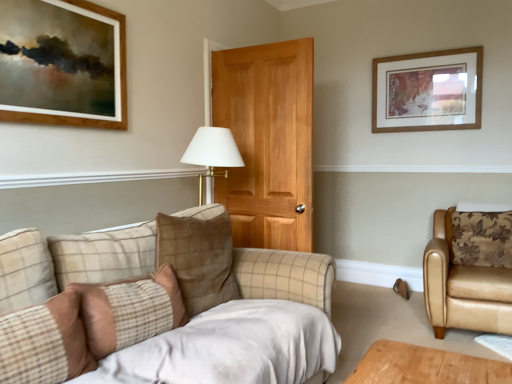
Question: Would you say brown plaid pillow at lower left, the first pillow in the left-to-right sequence, is part of wooden framed artwork at upper right's contents?

Choices:
 (A) yes
 (B) no

Answer: (B)

Question: Is wooden framed artwork at upper right facing towards brown plaid pillow at lower left, marked as the 4th pillow in a back-to-front arrangement?

Choices:
 (A) no
 (B) yes

Answer: (B)

Question: Is wooden framed artwork at upper right behind brown plaid pillow at lower left, the first pillow in the left-to-right sequence?

Choices:
 (A) yes
 (B) no

Answer: (A)

Question: Is wooden framed artwork at upper right directly adjacent to brown plaid pillow at lower left, acting as the first pillow starting from the front?

Choices:
 (A) yes
 (B) no

Answer: (B)

Question: Considering the relative positions of wooden framed artwork at upper right and brown plaid pillow at lower left, the 4th pillow in the right-to-left sequence, in the image provided, is wooden framed artwork at upper right to the left of brown plaid pillow at lower left, the 4th pillow in the right-to-left sequence, from the viewer's perspective?

Choices:
 (A) yes
 (B) no

Answer: (B)

Question: From a real-world perspective, is wooden framed artwork at upper right positioned over brown plaid pillow at lower left, the first pillow in the left-to-right sequence, based on gravity?

Choices:
 (A) yes
 (B) no

Answer: (A)

Question: Is plaid fabric pillow at lower left, marked as the second pillow in a front-to-back arrangement, positioned far away from wooden framed artwork at upper right?

Choices:
 (A) no
 (B) yes

Answer: (B)

Question: Is plaid fabric pillow at lower left, acting as the second pillow starting from the left, to the right of wooden framed artwork at upper right from the viewer's perspective?

Choices:
 (A) yes
 (B) no

Answer: (B)

Question: From a real-world perspective, is plaid fabric pillow at lower left, placed as the third pillow when sorted from right to left, under wooden framed artwork at upper right?

Choices:
 (A) no
 (B) yes

Answer: (B)

Question: Is plaid fabric pillow at lower left, placed as the 3th pillow when sorted from back to front, closer to camera compared to wooden framed artwork at upper right?

Choices:
 (A) no
 (B) yes

Answer: (B)

Question: Are plaid fabric pillow at lower left, marked as the second pillow in a front-to-back arrangement, and wooden framed artwork at upper right beside each other?

Choices:
 (A) no
 (B) yes

Answer: (A)

Question: Would you say wooden framed artwork at upper right is part of plaid fabric pillow at lower left, placed as the third pillow when sorted from right to left,'s contents?

Choices:
 (A) yes
 (B) no

Answer: (B)

Question: Can you confirm if tan leather armchair at right is taller than brown checkered pillow at center, which is the 2th pillow in right-to-left order?

Choices:
 (A) no
 (B) yes

Answer: (B)